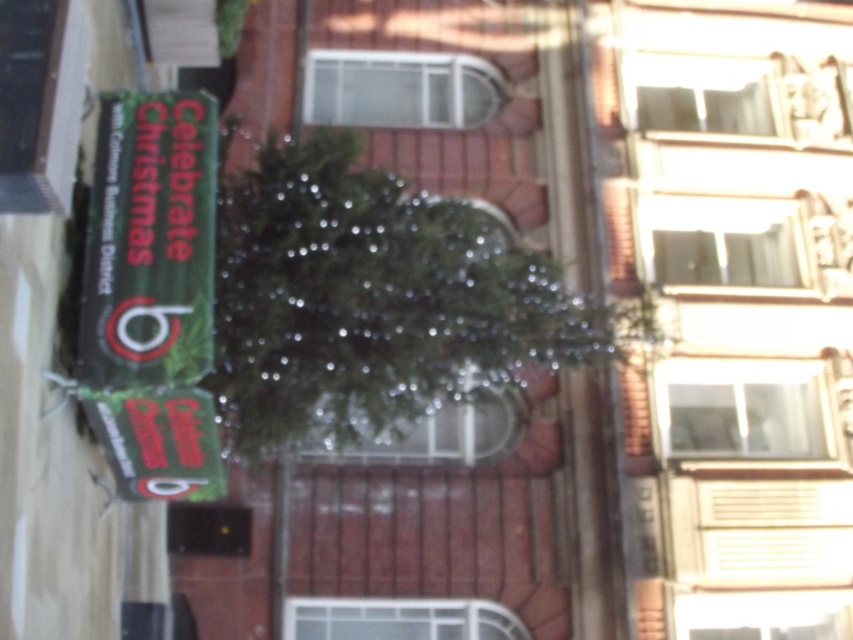
You are a delivery person who needs to place a package between the green shiny tree at center and the green matte sign at upper left. The package requires 8 feet of space. Is there enough space between them?

The green shiny tree at center is 7.77 feet from the green matte sign at upper left, so there is not enough space to place the package between them as it requires 8 feet.

What is the relationship between the height of the green shiny tree at center and the green matte sign at upper left in the festive outdoor scene?

The green shiny tree at center has a greater height compared to the green matte sign at upper left.

You are a delivery person who needs to place a large package between the green shiny tree at center and the green matte sign at upper left. Can you fit the package between them vertically?

The green shiny tree at center is located below the green matte sign at upper left, so there is vertical space between them. The package can be placed between them vertically as long as its height does not exceed the distance between the two objects.